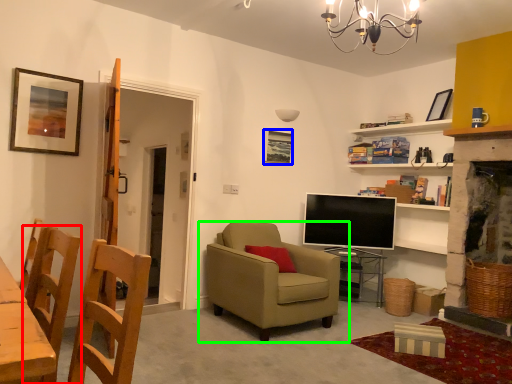
Question: Which object is the farthest from chair (highlighted by a red box)? Choose among these: picture frame (highlighted by a blue box) or chair (highlighted by a green box).

Choices:
 (A) picture frame
 (B) chair

Answer: (A)